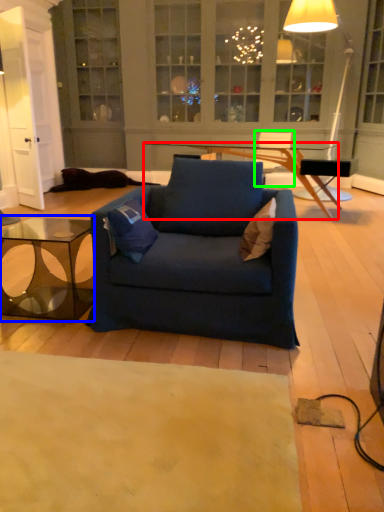
Question: Which object is the farthest from desk (highlighted by a red box)? Choose among these: coffee table (highlighted by a blue box) or armchair (highlighted by a green box).

Choices:
 (A) coffee table
 (B) armchair

Answer: (A)